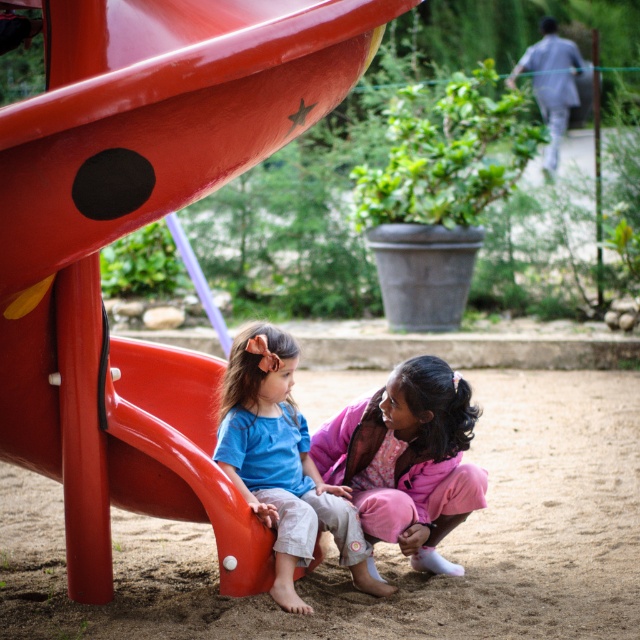
You are standing at the playground and want to walk from point A to point B. Point A is at coordinate point(412,3) and point B is at coordinate point(493,451). According to the image, which point is closer to you?

Point(412,3) is in front of point(493,451), so point A is closer to you.

You are a photographer standing in the playground and want to take a photo of the smooth plastic slide at center and the blue cotton shirt at lower left. Which object is positioned nearer to you?

The smooth plastic slide at center is closer to the viewer than the blue cotton shirt at lower left, so the slide is nearer to you.

You are designing a new playground and want to place a bench between the smooth plastic slide at center and the sandy brown at lower center. Which object should the bench be closer to if the bench needs to be placed closer to the wider object?

The bench should be placed closer to the smooth plastic slide at center because it is wider than the sandy brown at lower center.